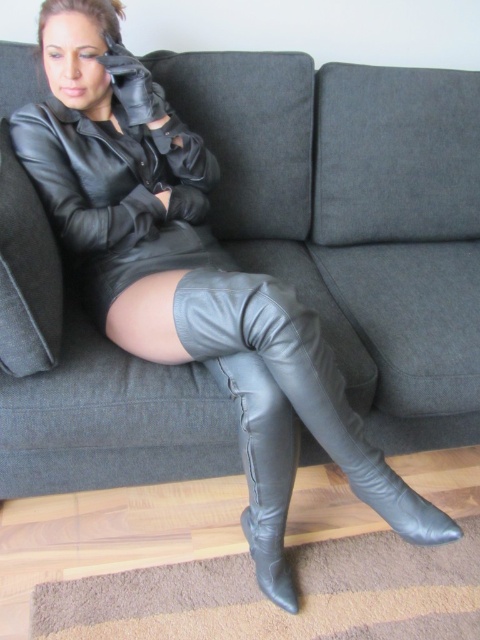
Question: Is the position of gray fabric couch at center less distant than that of black leather thigh-high boots at lower center?

Choices:
 (A) yes
 (B) no

Answer: (A)

Question: Is gray fabric couch at center further to the viewer compared to black leather boot at center?

Choices:
 (A) no
 (B) yes

Answer: (A)

Question: Among these objects, which one is farthest from the camera?

Choices:
 (A) black leather boot at center
 (B) black leather thigh-high boots at lower center

Answer: (A)

Question: Can you confirm if black leather dress at center is positioned to the left of black leather boot at center?

Choices:
 (A) no
 (B) yes

Answer: (B)

Question: Which object appears farthest from the camera in this image?

Choices:
 (A) black leather boot at center
 (B) black leather thigh-high boots at lower center
 (C) gray fabric couch at center
 (D) black leather dress at center

Answer: (D)

Question: Which object is farther from the camera taking this photo?

Choices:
 (A) gray fabric couch at center
 (B) black leather dress at center
 (C) black leather thigh-high boots at lower center
 (D) black leather boot at center

Answer: (B)